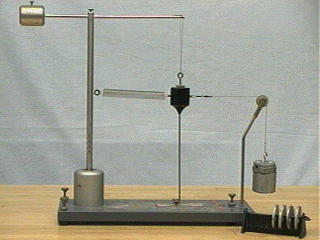
Find the location of `back of table`. back of table is located at coordinates (143, 184).